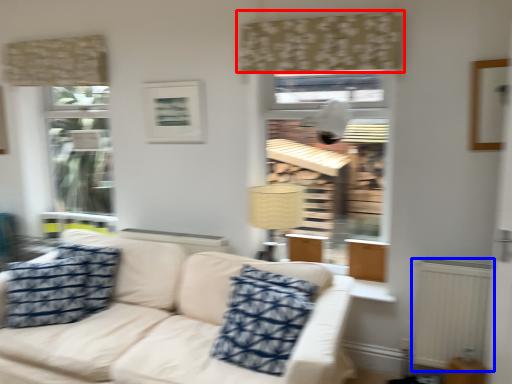
Question: Among these objects, which one is farthest to the camera, curtain (highlighted by a red box) or radiator (highlighted by a blue box)?

Choices:
 (A) curtain
 (B) radiator

Answer: (A)